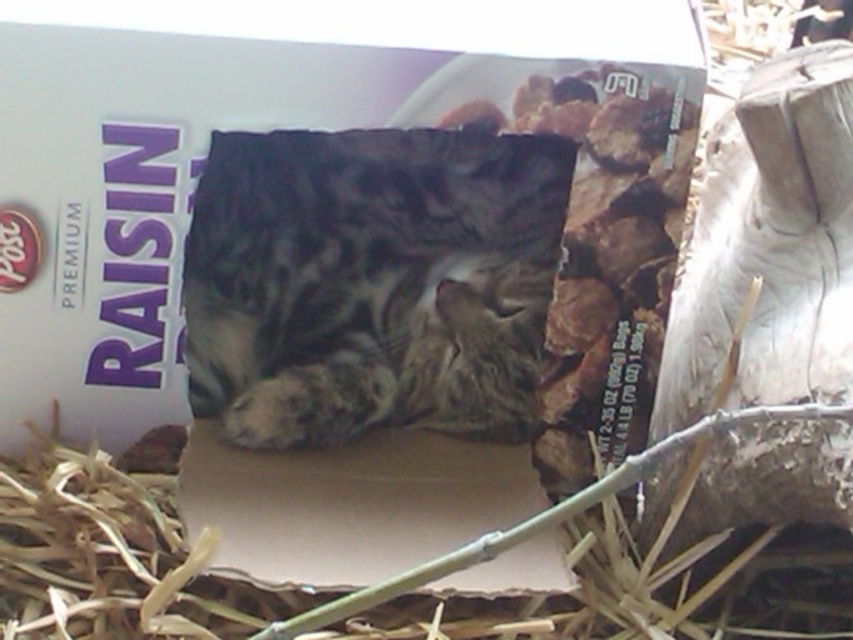
Question: Where is gray fur cat at center located in relation to brown cardboard at center in the image?

Choices:
 (A) below
 (B) above

Answer: (B)

Question: Does gray fur cat at center have a smaller size compared to brown cardboard at center?

Choices:
 (A) yes
 (B) no

Answer: (B)

Question: Based on their relative distances, which object is nearer to the gray fur cat at center?

Choices:
 (A) brown cardboard at center
 (B) brown straw at lower center

Answer: (A)

Question: Is brown cardboard at center thinner than brown straw at lower center?

Choices:
 (A) yes
 (B) no

Answer: (A)

Question: Which of the following is the farthest from the observer?

Choices:
 (A) gray fur cat at center
 (B) brown straw at lower center

Answer: (A)

Question: Among these objects, which one is farthest from the camera?

Choices:
 (A) brown straw at lower center
 (B) gray fur cat at center
 (C) brown cardboard at center

Answer: (B)